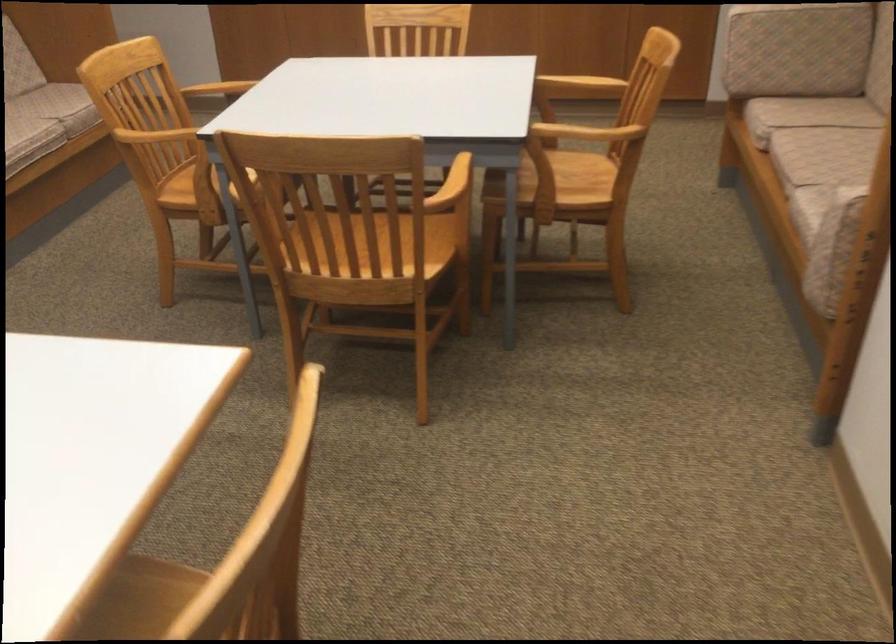
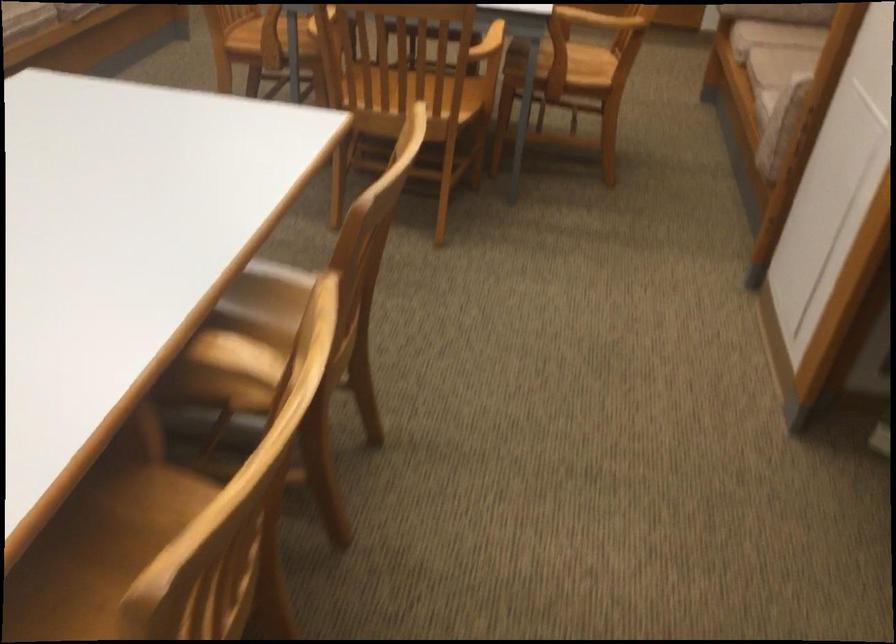
Locate, in the second image, the point that corresponds to pixel 194 196 in the first image.

(254, 42)